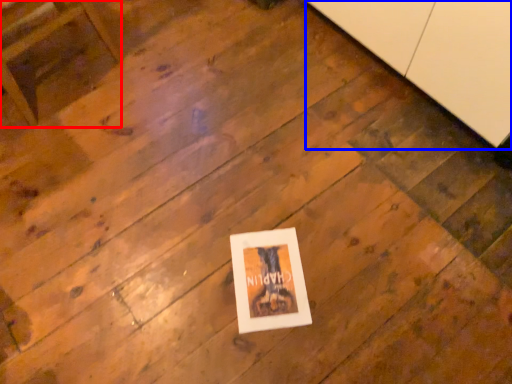
Question: Which object is closer to the camera taking this photo, furniture (highlighted by a red box) or cabinetry (highlighted by a blue box)?

Choices:
 (A) furniture
 (B) cabinetry

Answer: (B)